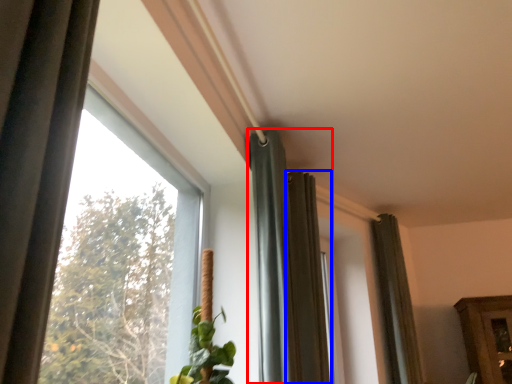
Question: Which of the following is the closest to the observer, curtain (highlighted by a red box) or curtain (highlighted by a blue box)?

Choices:
 (A) curtain
 (B) curtain

Answer: (A)